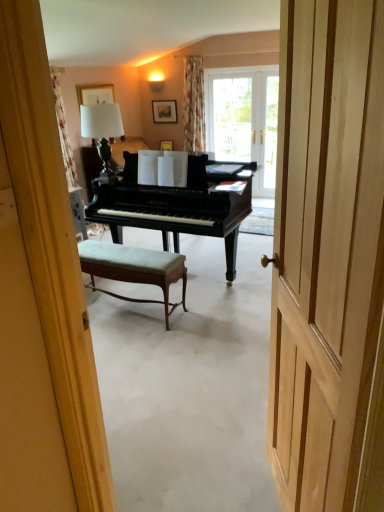
Question: Is white fabric lampshade at upper center smaller than wooden picture frame at upper center, the first picture frame when ordered from right to left?

Choices:
 (A) yes
 (B) no

Answer: (B)

Question: Is there a large distance between white fabric lampshade at upper center and wooden picture frame at upper center, placed as the first picture frame when sorted from back to front?

Choices:
 (A) no
 (B) yes

Answer: (B)

Question: Is white fabric lampshade at upper center further to camera compared to wooden picture frame at upper center, the first picture frame when ordered from right to left?

Choices:
 (A) no
 (B) yes

Answer: (A)

Question: Is white fabric lampshade at upper center facing away from wooden picture frame at upper center, placed as the first picture frame when sorted from back to front?

Choices:
 (A) yes
 (B) no

Answer: (A)

Question: From a real-world perspective, is white fabric lampshade at upper center located higher than wooden picture frame at upper center, placed as the 2th picture frame when sorted from left to right?

Choices:
 (A) no
 (B) yes

Answer: (B)

Question: Considering the relative sizes of white fabric lampshade at upper center and wooden picture frame at upper center, the first picture frame when ordered from right to left, in the image provided, is white fabric lampshade at upper center taller than wooden picture frame at upper center, the first picture frame when ordered from right to left,?

Choices:
 (A) no
 (B) yes

Answer: (B)

Question: From a real-world perspective, is transparent glass door at upper center on velvet green stool at center?

Choices:
 (A) yes
 (B) no

Answer: (A)

Question: Can you confirm if transparent glass door at upper center is shorter than velvet green stool at center?

Choices:
 (A) no
 (B) yes

Answer: (A)

Question: From the image's perspective, would you say transparent glass door at upper center is positioned over velvet green stool at center?

Choices:
 (A) yes
 (B) no

Answer: (A)

Question: Is transparent glass door at upper center not close to velvet green stool at center?

Choices:
 (A) no
 (B) yes

Answer: (B)

Question: Is transparent glass door at upper center placed right next to velvet green stool at center?

Choices:
 (A) yes
 (B) no

Answer: (B)

Question: Is transparent glass door at upper center smaller than velvet green stool at center?

Choices:
 (A) yes
 (B) no

Answer: (A)

Question: Could you tell me if wooden picture frame at upper center, the first picture frame when ordered from right to left, is turned towards matte wooden picture frame at upper center, the second picture frame from the back?

Choices:
 (A) yes
 (B) no

Answer: (A)